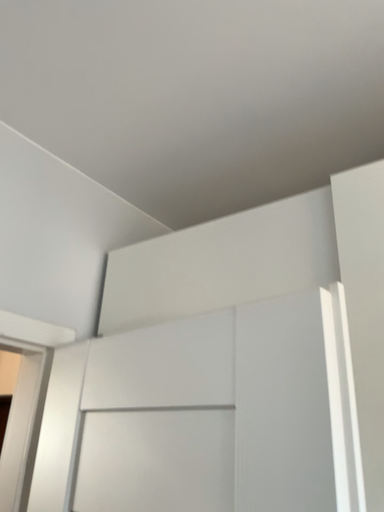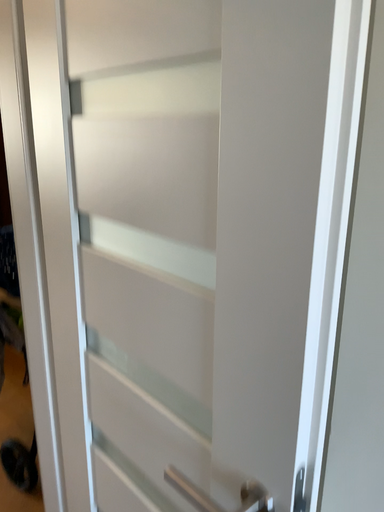
Question: Which way did the camera rotate in the video?

Choices:
 (A) rotated downward
 (B) rotated upward

Answer: (A)